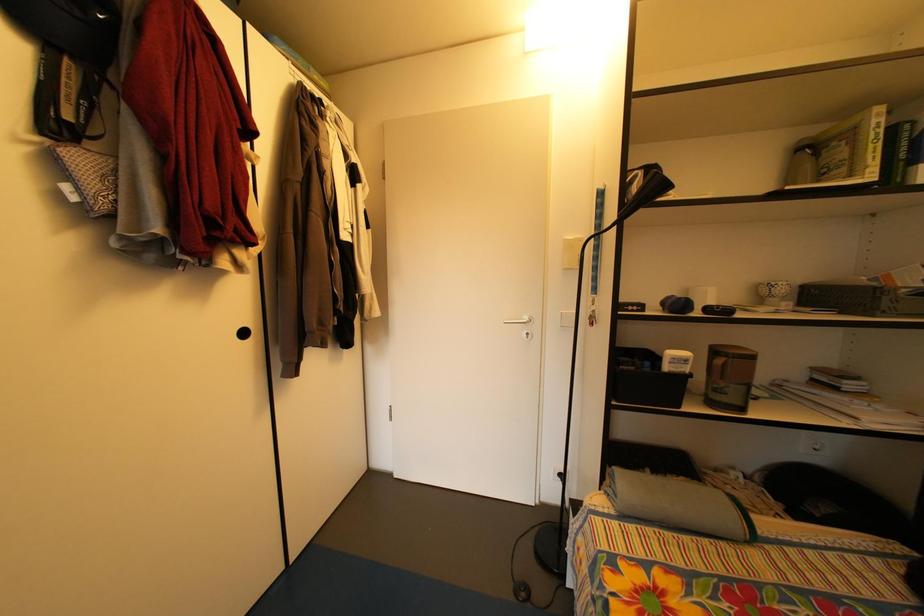
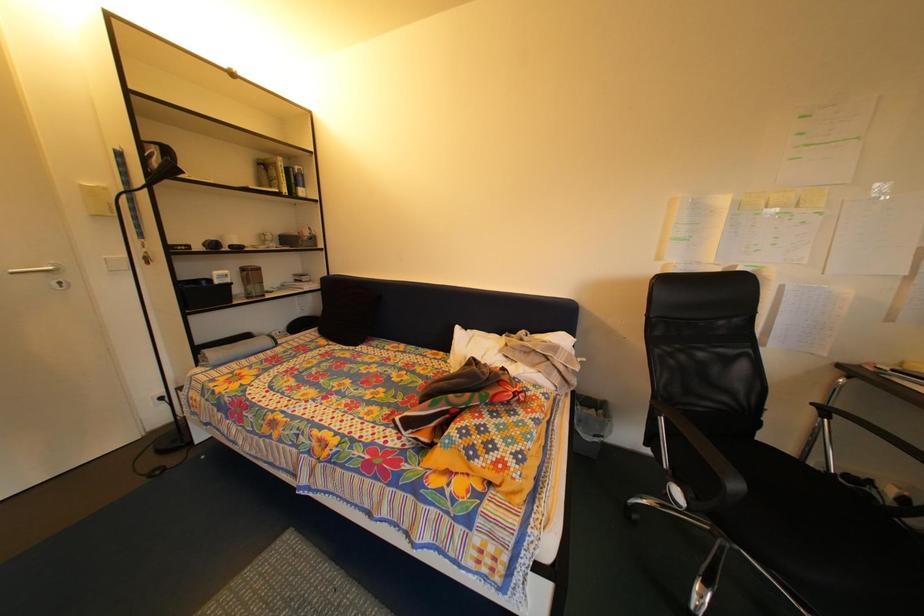
Question: The images are taken continuously from a first-person perspective. In which direction is your viewpoint rotating?

Choices:
 (A) Left
 (B) Right
 (C) Up
 (D) Down

Answer: (B)